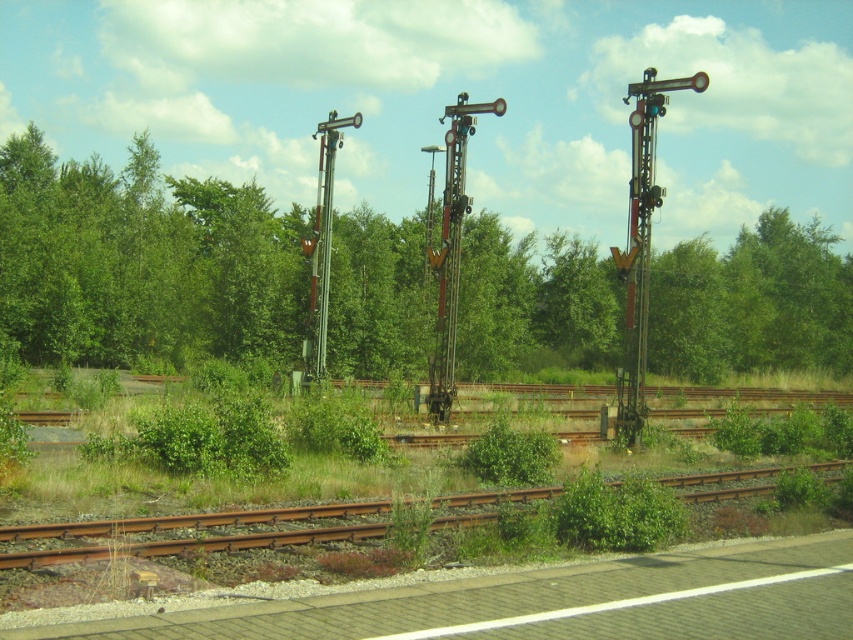
Question: Does green leafy trees at center lie behind rusty metal train track at lower center?

Choices:
 (A) no
 (B) yes

Answer: (B)

Question: Considering the real-world distances, which object is closest to the green leafy trees at center?

Choices:
 (A) metallic gray pole at center
 (B) rusty metal telegraph pole at right
 (C) rusty metal train track at lower center

Answer: (A)

Question: Which of the following is the farthest from the observer?

Choices:
 (A) (33, 560)
 (B) (25, 314)
 (C) (628, 241)

Answer: (B)

Question: Among these points, which one is farthest from the camera?

Choices:
 (A) (625, 397)
 (B) (439, 278)

Answer: (B)

Question: Does green leafy trees at center have a greater width compared to metallic gray pole at center?

Choices:
 (A) yes
 (B) no

Answer: (A)

Question: Can you confirm if rusty metal train track at lower center is positioned above rusty metal telegraph pole at right?

Choices:
 (A) yes
 (B) no

Answer: (B)